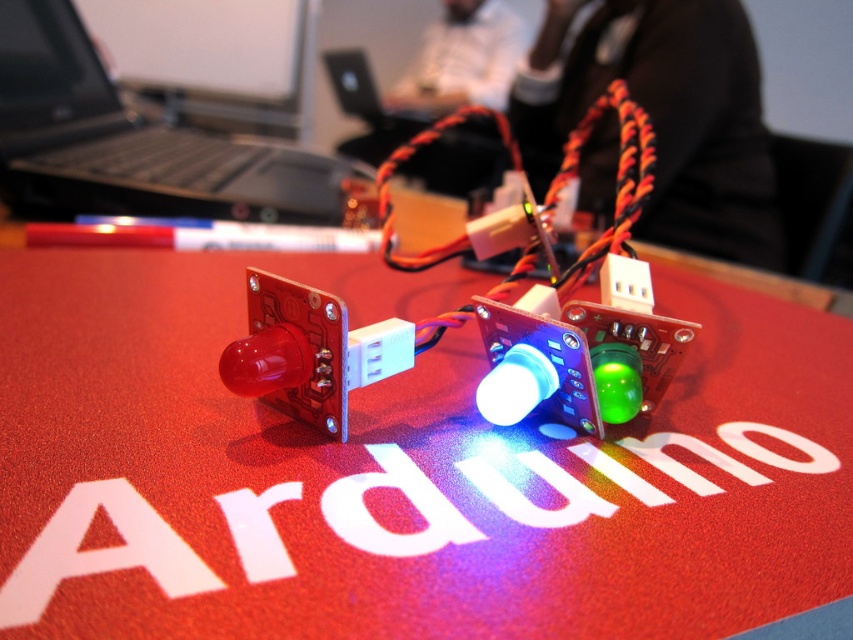
You are an electronics engineer working on a project. You need to place a 15cm tall tool on the desk. The red matte arduino board at center and the black plastic laptop at upper left are already there. Which object will the tool block if placed in front of it?

The red matte arduino board at center is taller than the black plastic laptop at upper left. Placing the tool in front of the red matte arduino board at center would block it since it is taller.

You are working on an electronics project and need to connect two points on the Arduino board. The points are labeled as point (822, 612) and point (27, 77). If you want to connect a wire from the point closer to you to the one further away, which point should you start from?

Point (822, 612) is in front of point (27, 77), so you should start from point (822, 612) to connect the wire to the further point (27, 77).

You are an electronics hobbyist working on a project. You have a red matte arduino board at center and a black plastic laptop at upper left in front of you. Which object is located to the right of the other?

The red matte arduino board at center is positioned on the right side of black plastic laptop at upper left.